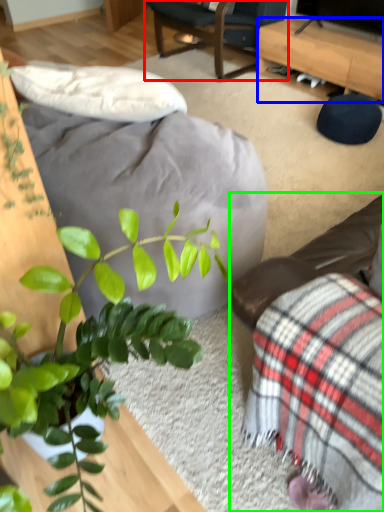
Question: Which object is positioned closest to chair (highlighted by a red box)? Select from desk (highlighted by a blue box) and studio couch (highlighted by a green box).

Choices:
 (A) desk
 (B) studio couch

Answer: (A)